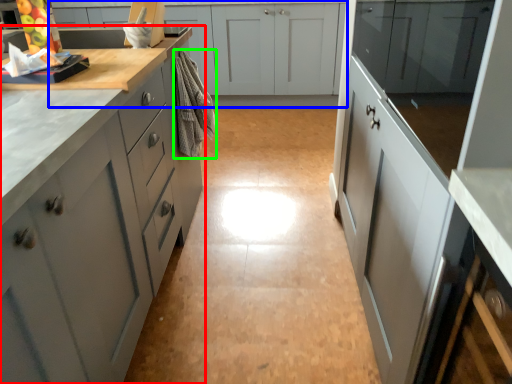
Question: Which is nearer to the cabinetry (highlighted by a red box)? cabinetry (highlighted by a blue box) or material (highlighted by a green box).

Choices:
 (A) cabinetry
 (B) material

Answer: (B)